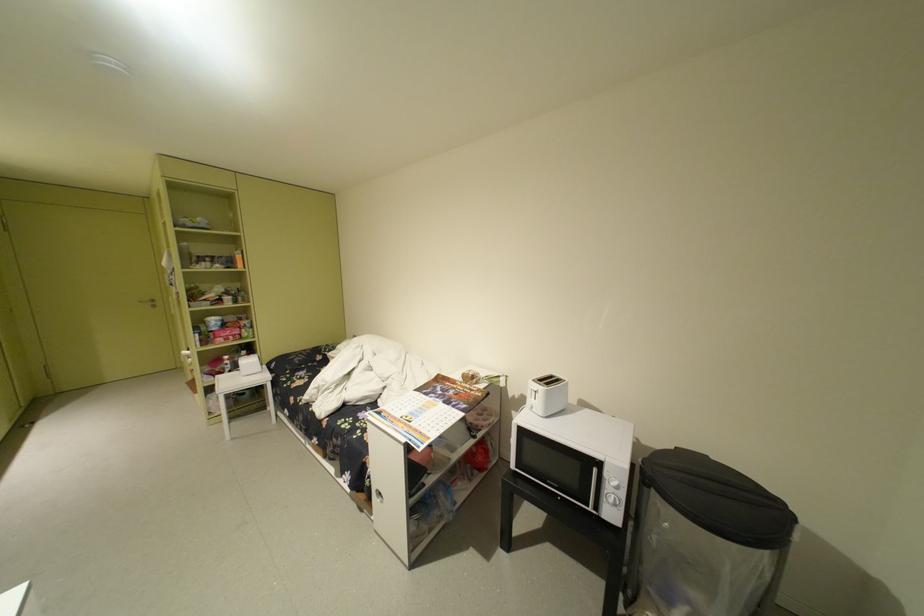
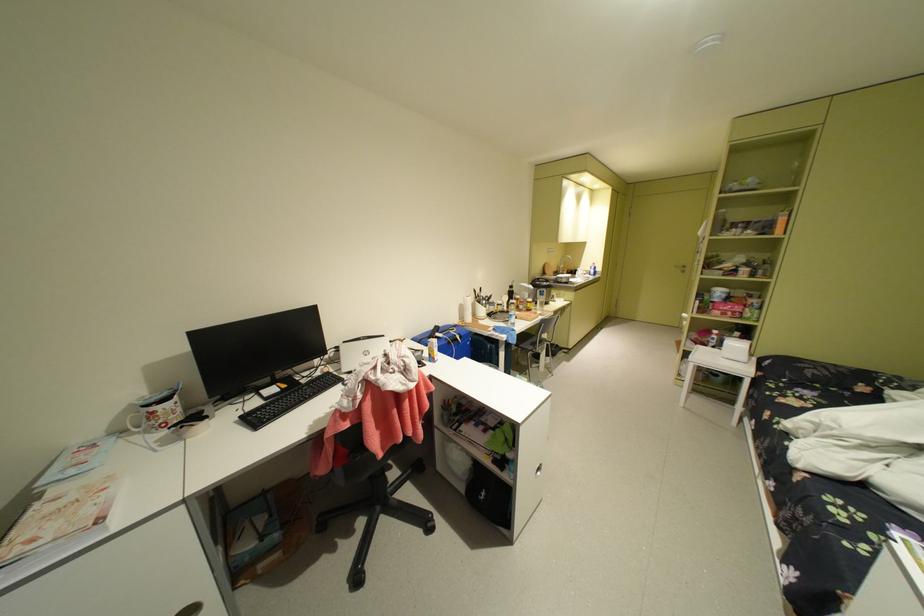
First-person continuous shooting, in which direction is the camera rotating?

The camera's rotation is toward left-down.